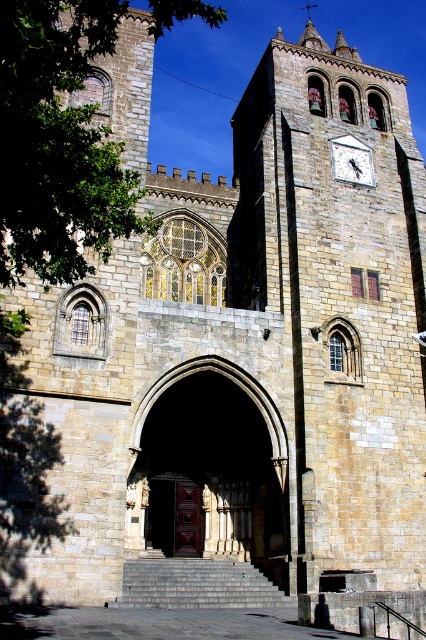
Which of these two, stone archway at center or white stone clock at upper right, stands taller?

stone archway at center is taller.

How much distance is there between stone archway at center and white stone clock at upper right?

stone archway at center is 87.85 feet away from white stone clock at upper right.

Does point (235, 404) come closer to viewer compared to point (356, 147)?

Yes, it is.

You are a GUI agent. You are given a task and a screenshot of the screen. Output one action in this format:
    pyautogui.click(x=<x>, y=<y>)
    Task: Click on the stone archway at center
    This screenshot has width=426, height=640.
    Given the screenshot: What is the action you would take?
    pyautogui.click(x=210, y=468)

Is stone archway at center further to the viewer compared to gray stone stairs at center?

Yes, stone archway at center is behind gray stone stairs at center.

Who is more forward, (166, 406) or (150, 604)?

Point (150, 604) is more forward.

Identify the location of stone archway at center. (210, 468).

Identify the location of stone archway at center. (210, 468).

Who is positioned more to the right, gray stone stairs at center or brown wooden door at center?

From the viewer's perspective, brown wooden door at center appears more on the right side.

How far apart are gray stone stairs at center and brown wooden door at center?

gray stone stairs at center and brown wooden door at center are 9.04 meters apart from each other.

Where is `gray stone stairs at center`? Image resolution: width=426 pixels, height=640 pixels. gray stone stairs at center is located at coordinates (196, 584).

Where is `gray stone stairs at center`? gray stone stairs at center is located at coordinates (196, 584).